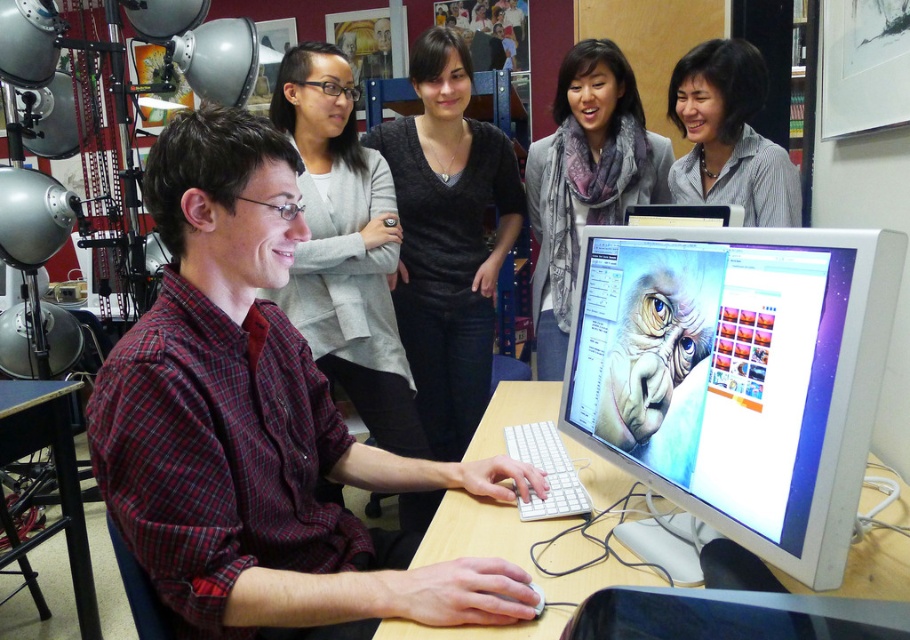
Based on the photo, you are organizing a small event and need to place a 1.2 meter wide banner between the black glossy monitor at center and the black wood table at lower left. Based on their widths, will the banner fit between them?

The black glossy monitor at center has a lesser width compared to black wood table at lower left. However, the banner is 1.2 meters wide, and without knowing the exact distance between the two objects, it is impossible to determine if the banner will fit. The question only provides information about their widths, not the space between them.

You are a photographer standing at the camera position. You want to focus on the point that is closer to you. Which point should you choose between point [746,596] and point [59,522]?

Point [746,596] is closer to the camera than point [59,522], so you should focus on point [746,596].

You are organizing a photoshoot and need to decide which item to place in the foreground for maximum visibility. Based on their sizes, should you choose the plaid flannel shirt at left or the wooden table at center?

The plaid flannel shirt at left has a larger size compared to the wooden table at center, so it would be more visible in the foreground.